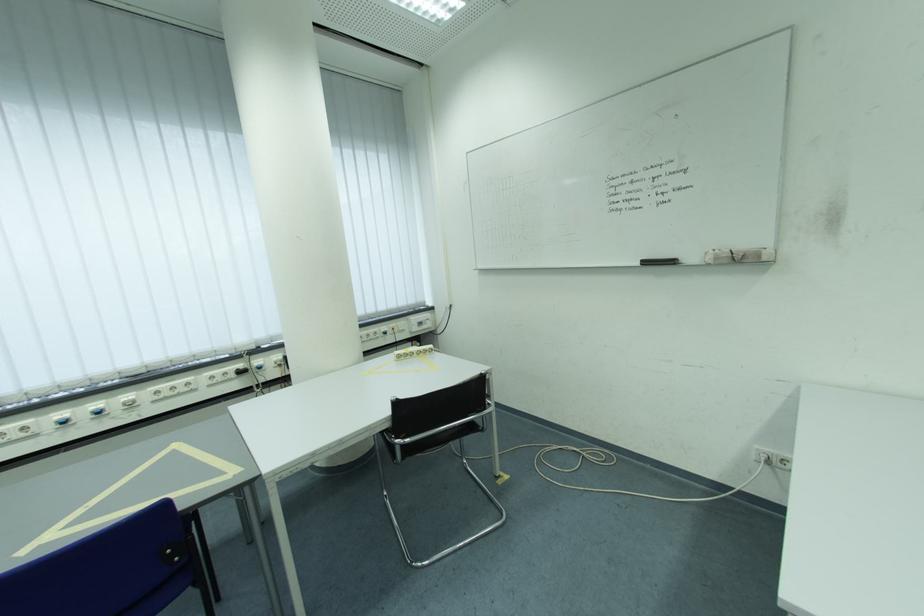
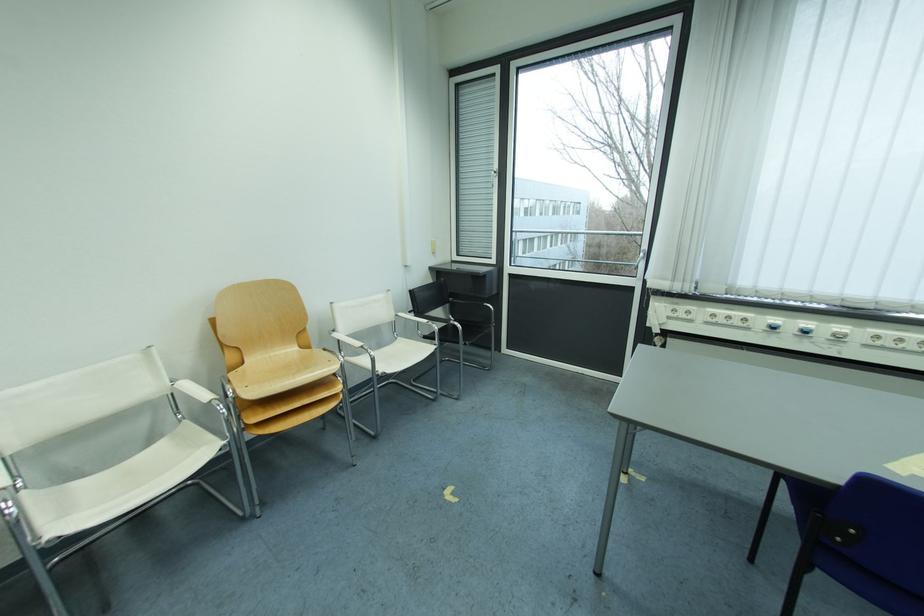
Locate, in the second image, the point that corresponds to point 136,399 in the first image.

(849, 330)